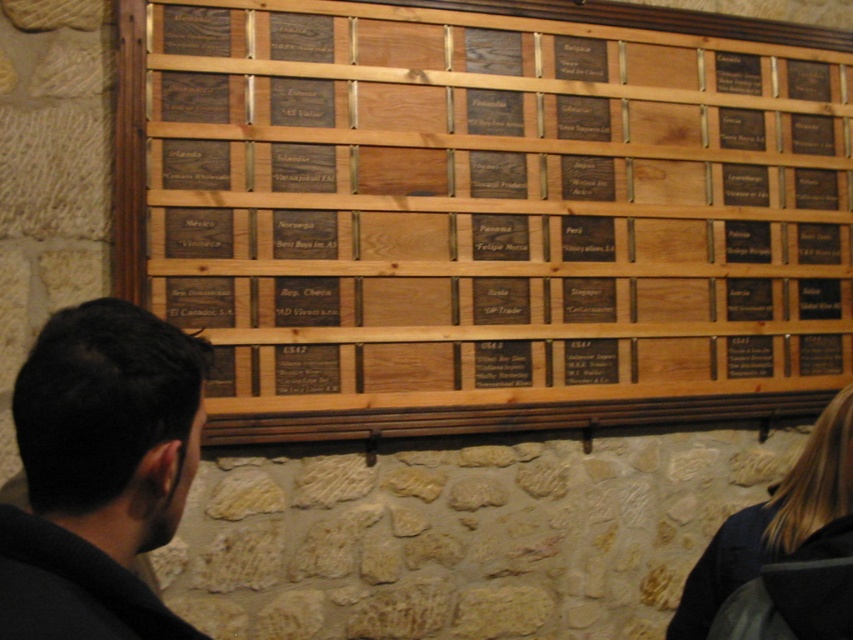
Looking at this image, you are an artist standing in front of the wooden plaque on the stone wall. You notice the black wood plaque at center and the blonde hair at lower right. Which object is bigger in size?

The black wood plaque at center is larger in size than the blonde hair at lower right.

You are standing in front of the wooden plaque and want to touch both the dark brown hair at center and the blonde hair at lower right. Which one do you need to reach further for?

The dark brown hair at center is 3.49 feet away from the blonde hair at lower right. Since you need to reach both, the one further away would depend on your starting position. However, based on their positions, the blonde hair at lower right is positioned lower and to the right, so depending on where you are standing, you might need to reach further for either. Without exact positioning details, it is hard to determine.

You are standing in front of the wooden plaque on the stone wall. You notice the black wood plaque at center and the blonde hair at lower right. Which object is positioned higher in the scene?

The black wood plaque at center is above blonde hair at lower right, so the black wood plaque at center is positioned higher in the scene.